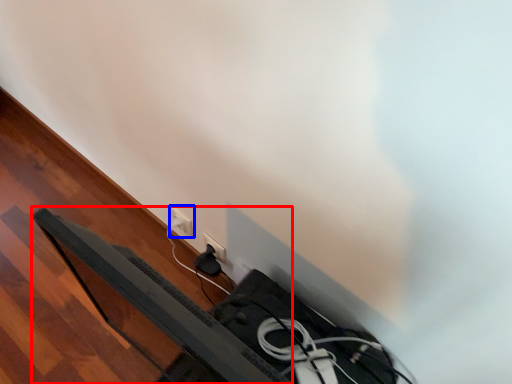
Question: Among these objects, which one is farthest to the camera, bed frame (highlighted by a red box) or power plugs and sockets (highlighted by a blue box)?

Choices:
 (A) bed frame
 (B) power plugs and sockets

Answer: (B)